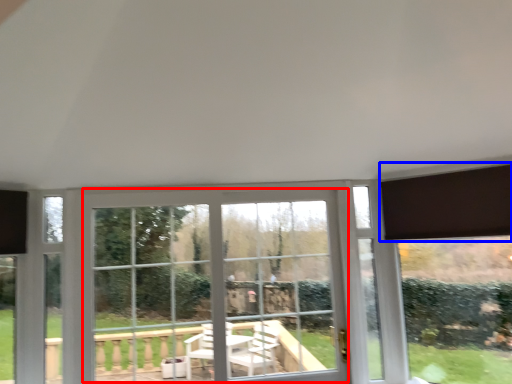
Question: Which object is closer to the camera taking this photo, bay window (highlighted by a red box) or curtain (highlighted by a blue box)?

Choices:
 (A) bay window
 (B) curtain

Answer: (B)